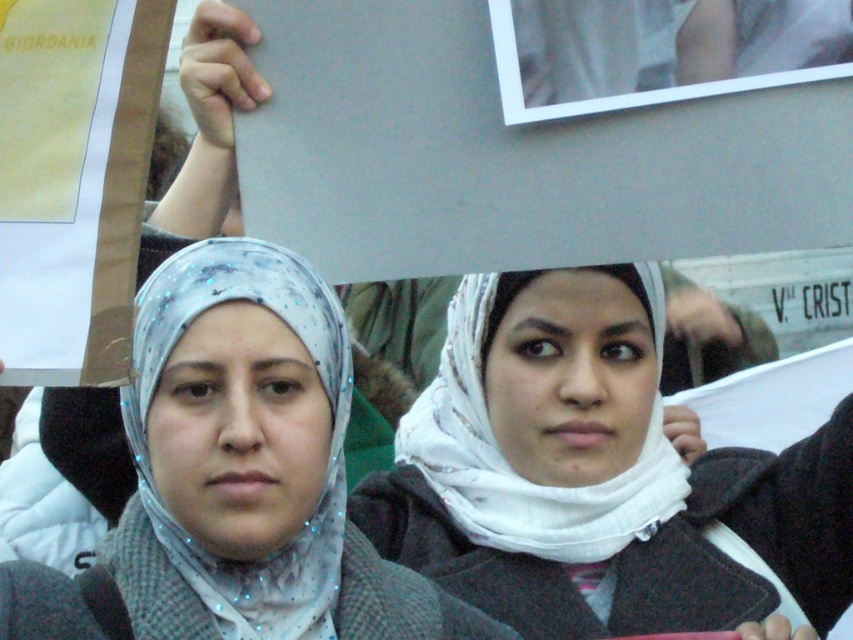
Question: Is white fabric headscarf at center to the left of matte gray scarf at center from the viewer's perspective?

Choices:
 (A) yes
 (B) no

Answer: (B)

Question: Is white fabric headscarf at center above matte gray scarf at center?

Choices:
 (A) no
 (B) yes

Answer: (B)

Question: Is white fabric headscarf at center to the right of matte gray scarf at center from the viewer's perspective?

Choices:
 (A) yes
 (B) no

Answer: (A)

Question: Which point appears closest to the camera in this image?

Choices:
 (A) (508, 547)
 (B) (119, 561)

Answer: (B)

Question: Which point appears closest to the camera in this image?

Choices:
 (A) (99, 625)
 (B) (573, 352)

Answer: (A)

Question: Which object is closer to the camera taking this photo?

Choices:
 (A) white fabric headscarf at center
 (B) matte gray scarf at center

Answer: (B)